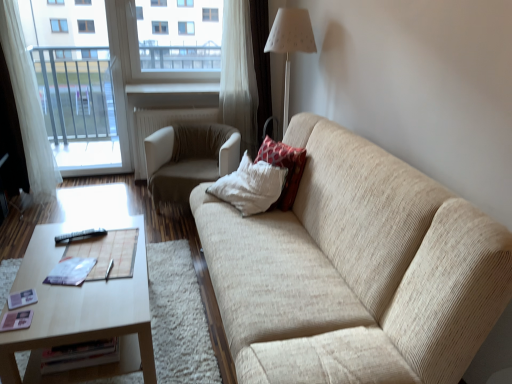
This screenshot has width=512, height=384. Identify the location of free point above light brown wooden coffee table at lower left (from a real-world perspective). (82, 270).